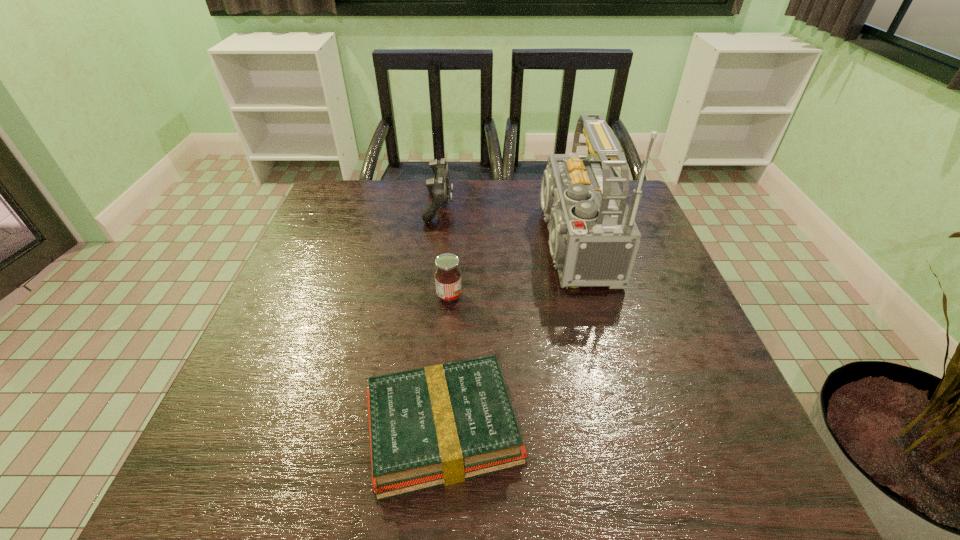
This screenshot has height=540, width=960. Identify the location of free spot between the tallest object and the control. (502, 225).

The image size is (960, 540). I want to click on free point between the rightmost object and the control, so click(x=502, y=225).

Locate which object ranks second in proximity to the radio receiver. Please provide its 2D coordinates. Your answer should be formatted as a tuple, i.e. [(x, y)], where the tuple contains the x and y coordinates of a point satisfying the conditions above.

[(438, 185)]

Locate an element on the screen. The width and height of the screenshot is (960, 540). object that is the closest one to the third tallest object is located at coordinates (593, 237).

Where is `free space that satisfies the following two spatial constraints: 1. on the front-facing side of the tallest object; 2. on the front side of the nearest object`? free space that satisfies the following two spatial constraints: 1. on the front-facing side of the tallest object; 2. on the front side of the nearest object is located at coordinates (609, 429).

You are a GUI agent. You are given a task and a screenshot of the screen. Output one action in this format:
    pyautogui.click(x=<x>, y=<y>)
    Task: Click on the free point that satisfies the following two spatial constraints: 1. on the surface of the control with buttons; 2. on the back side of the shortest object
    This screenshot has width=960, height=540.
    Given the screenshot: What is the action you would take?
    pyautogui.click(x=412, y=429)

This screenshot has width=960, height=540. What are the coordinates of `free space that satisfies the following two spatial constraints: 1. on the surface of the control with buttons; 2. on the back side of the hardback book` in the screenshot? It's located at (412, 429).